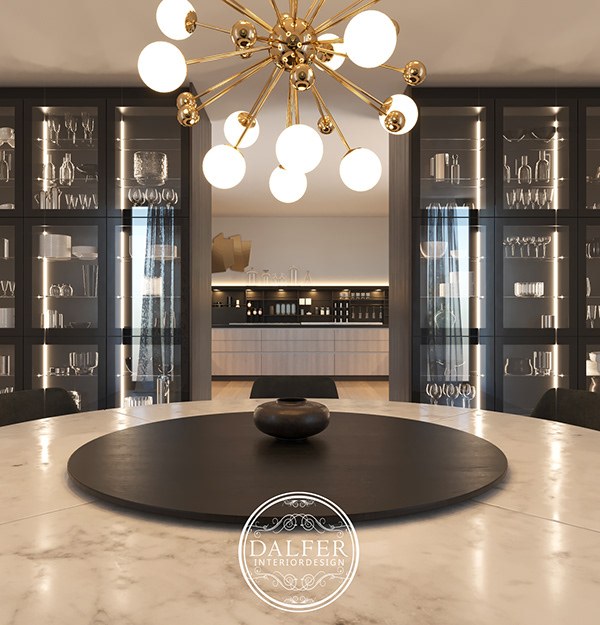
Where is `light fixture`? Image resolution: width=600 pixels, height=625 pixels. light fixture is located at coordinates (292, 42).